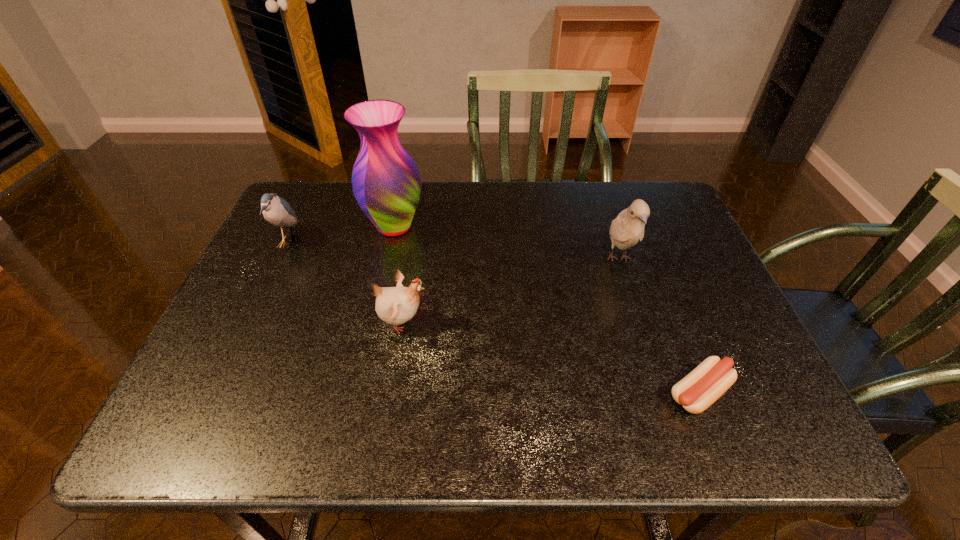
Find the location of a particular element. vase is located at coordinates (386, 183).

Image resolution: width=960 pixels, height=540 pixels. What are the coordinates of `the fourth shortest object` in the screenshot? It's located at (627, 229).

Find the location of a particular element. Image resolution: width=960 pixels, height=540 pixels. the rightmost bird is located at coordinates (627, 229).

Find the location of a particular element. the leftmost bird is located at coordinates (277, 211).

This screenshot has width=960, height=540. What are the coordinates of `the second tallest bird` in the screenshot? It's located at (277, 211).

The image size is (960, 540). Find the location of `the second bird from right to left`. the second bird from right to left is located at coordinates (394, 305).

The width and height of the screenshot is (960, 540). In order to click on the fourth farthest object in this screenshot , I will do `click(394, 305)`.

Locate an element on the screen. sausage is located at coordinates (698, 390).

Where is `the nearest object`? Image resolution: width=960 pixels, height=540 pixels. the nearest object is located at coordinates (698, 390).

Where is `free region located on the front of the vase`? Image resolution: width=960 pixels, height=540 pixels. free region located on the front of the vase is located at coordinates (367, 352).